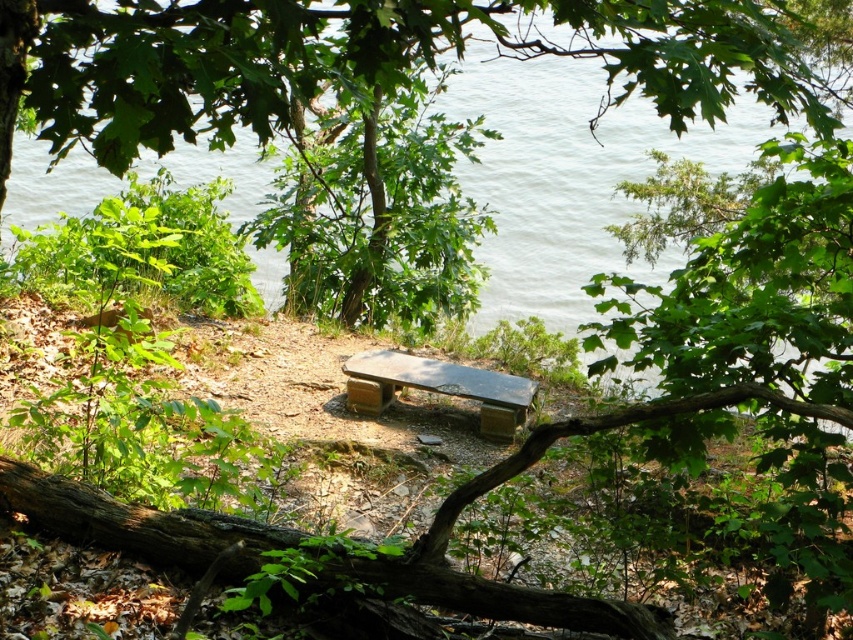
Question: Does green leafy tree at center have a lesser width compared to smooth wooden bench at center?

Choices:
 (A) no
 (B) yes

Answer: (A)

Question: Is green leafy tree at center positioned in front of smooth wooden bench at center?

Choices:
 (A) yes
 (B) no

Answer: (A)

Question: Which object is closer to the camera taking this photo?

Choices:
 (A) smooth wooden bench at center
 (B) green leafy tree at center

Answer: (B)

Question: Is green leafy tree at center smaller than smooth wooden bench at center?

Choices:
 (A) no
 (B) yes

Answer: (A)

Question: Which of the following is the farthest from the observer?

Choices:
 (A) (33, 74)
 (B) (399, 381)

Answer: (B)